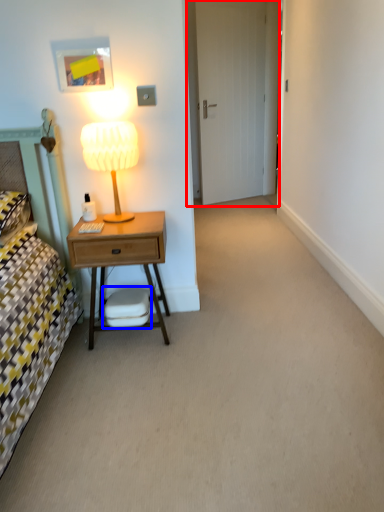
Question: Which object appears closest to the camera in this image, door (highlighted by a red box) or swivel chair (highlighted by a blue box)?

Choices:
 (A) door
 (B) swivel chair

Answer: (B)